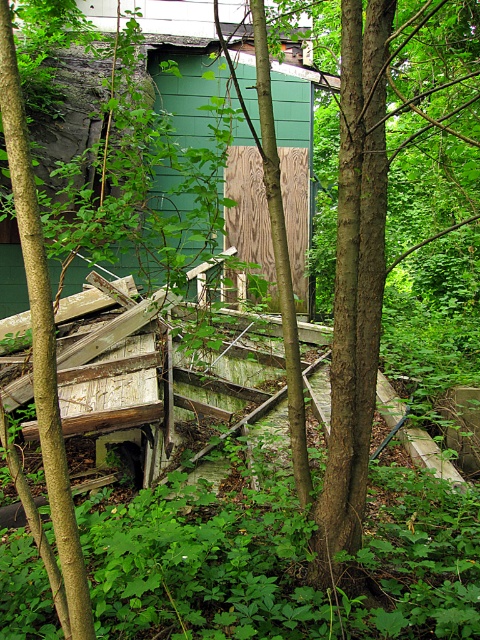
Question: Which point is farther from the camera taking this photo?

Choices:
 (A) coord(307,131)
 (B) coord(225,211)

Answer: (A)

Question: Observing the image, what is the correct spatial positioning of green wood paneling at center in reference to wooden panel at center?

Choices:
 (A) left
 (B) right

Answer: (B)

Question: Which of the following is the closest to the observer?

Choices:
 (A) green wood paneling at center
 (B) wooden panel at center

Answer: (B)

Question: Does green wood paneling at center come behind wooden panel at center?

Choices:
 (A) no
 (B) yes

Answer: (B)

Question: Does green wood paneling at center have a smaller size compared to wooden panel at center?

Choices:
 (A) no
 (B) yes

Answer: (A)

Question: Which object appears closest to the camera in this image?

Choices:
 (A) green wood paneling at center
 (B) wooden panel at center

Answer: (B)